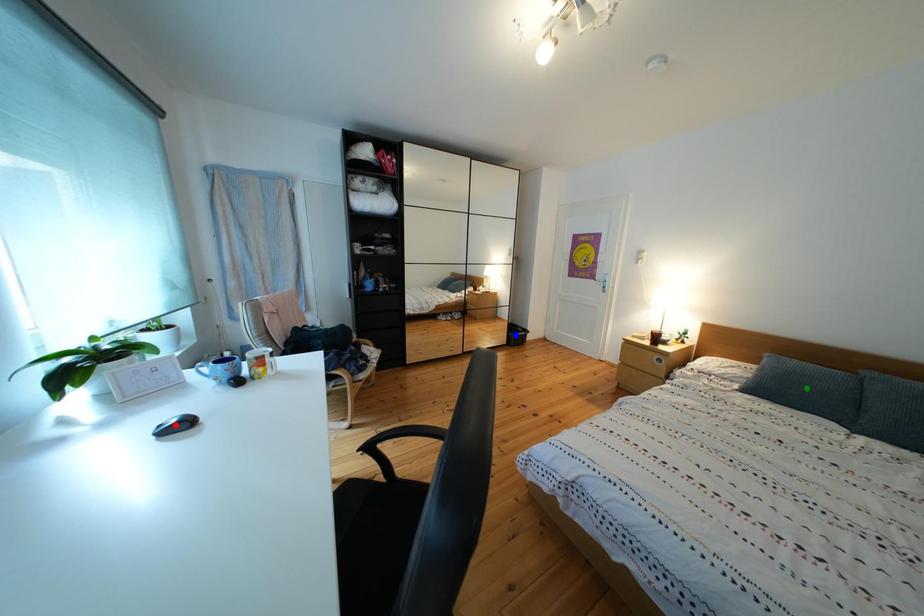
Order these from nearest to farthest:
A) red point
B) blue point
C) green point

red point < green point < blue point